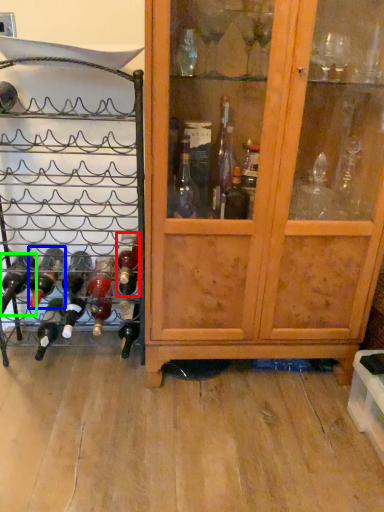
Question: Considering the real-world distances, which object is farthest from bottle (highlighted by a red box)? bottle (highlighted by a blue box) or bottle (highlighted by a green box)?

Choices:
 (A) bottle
 (B) bottle

Answer: (B)